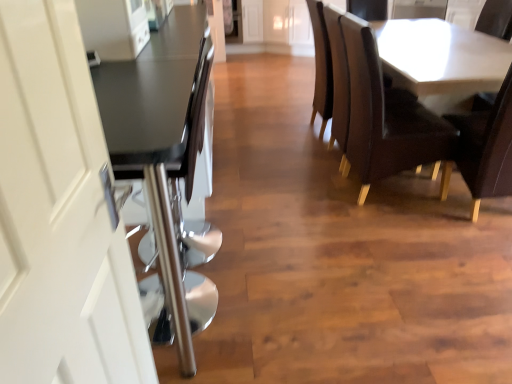
Find the location of a particular element. Image resolution: width=512 pixels, height=384 pixels. vacant space situated on the left part of leather seat at right, which ranks as the 2th chair in right-to-left order is located at coordinates (307, 196).